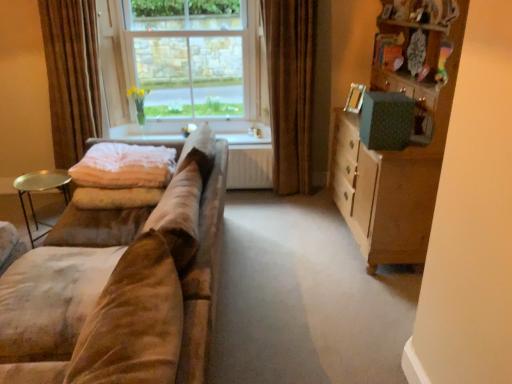
Question: Would you consider wooden cabinet at right to be distant from white glossy window sill at center?

Choices:
 (A) yes
 (B) no

Answer: (A)

Question: From the image's perspective, would you say wooden cabinet at right is shown under white glossy window sill at center?

Choices:
 (A) no
 (B) yes

Answer: (B)

Question: Is wooden cabinet at right further to camera compared to white glossy window sill at center?

Choices:
 (A) yes
 (B) no

Answer: (B)

Question: Does wooden cabinet at right have a smaller size compared to white glossy window sill at center?

Choices:
 (A) no
 (B) yes

Answer: (A)

Question: Considering the relative sizes of wooden cabinet at right and white glossy window sill at center in the image provided, is wooden cabinet at right shorter than white glossy window sill at center?

Choices:
 (A) yes
 (B) no

Answer: (B)

Question: Looking at their shapes, would you say pink soft fabric blanket at left is wider or thinner than gold metallic tray at left?

Choices:
 (A) thin
 (B) wide

Answer: (B)

Question: From the image's perspective, relative to gold metallic tray at left, is pink soft fabric blanket at left above or below?

Choices:
 (A) below
 (B) above

Answer: (B)

Question: Based on their sizes in the image, would you say pink soft fabric blanket at left is bigger or smaller than gold metallic tray at left?

Choices:
 (A) small
 (B) big

Answer: (B)

Question: Which is correct: pink soft fabric blanket at left is inside gold metallic tray at left, or outside of it?

Choices:
 (A) inside
 (B) outside

Answer: (B)

Question: Is brown velvet curtain at center, the 2th curtain viewed from the left, taller or shorter than suede couch at left?

Choices:
 (A) tall
 (B) short

Answer: (A)

Question: Considering their positions, is brown velvet curtain at center, the 1th curtain positioned from the right, located in front of or behind suede couch at left?

Choices:
 (A) behind
 (B) front

Answer: (A)

Question: In terms of width, does brown velvet curtain at center, the 1th curtain positioned from the right, look wider or thinner when compared to suede couch at left?

Choices:
 (A) wide
 (B) thin

Answer: (B)

Question: Considering the positions of point (295, 145) and point (101, 228), is point (295, 145) closer or farther from the camera than point (101, 228)?

Choices:
 (A) farther
 (B) closer

Answer: (A)

Question: From the image's perspective, is clear glass window at center located above or below pink soft fabric blanket at left?

Choices:
 (A) above
 (B) below

Answer: (A)

Question: Visually, is clear glass window at center positioned to the left or to the right of pink soft fabric blanket at left?

Choices:
 (A) left
 (B) right

Answer: (B)